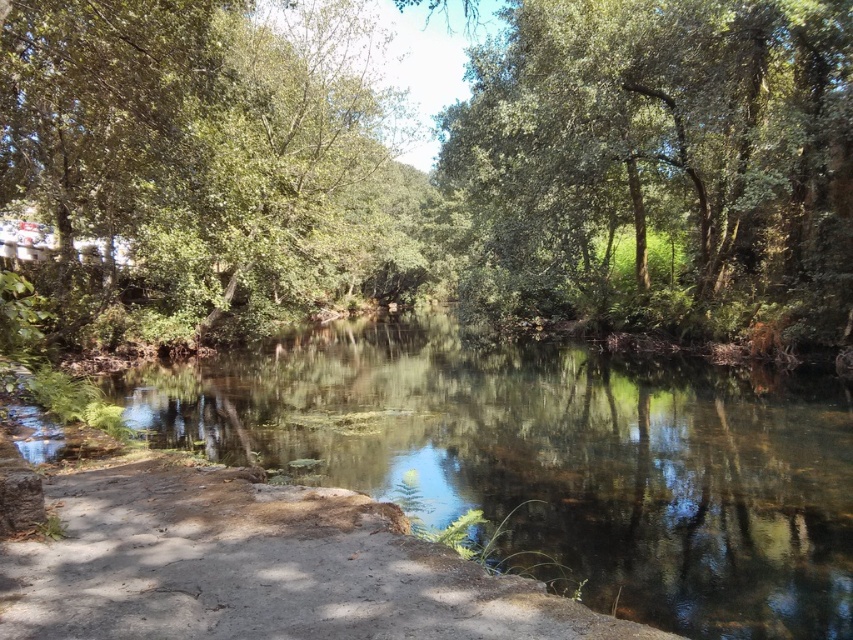
Question: Is green leafy tree at center smaller than green leafy tree at upper center?

Choices:
 (A) no
 (B) yes

Answer: (A)

Question: Which of the following is the farthest from the observer?

Choices:
 (A) (131, 516)
 (B) (776, 150)

Answer: (B)

Question: Is green leafy tree at upper center to the right of dull gray concrete at lower left from the viewer's perspective?

Choices:
 (A) no
 (B) yes

Answer: (B)

Question: Is green leafy tree at center to the left of green leafy tree at upper center from the viewer's perspective?

Choices:
 (A) yes
 (B) no

Answer: (A)

Question: Which point is farther from the camera taking this photo?

Choices:
 (A) (236, 148)
 (B) (798, 29)

Answer: (A)

Question: Which of the following is the closest to the observer?

Choices:
 (A) green leafy tree at center
 (B) green leafy tree at upper center

Answer: (A)